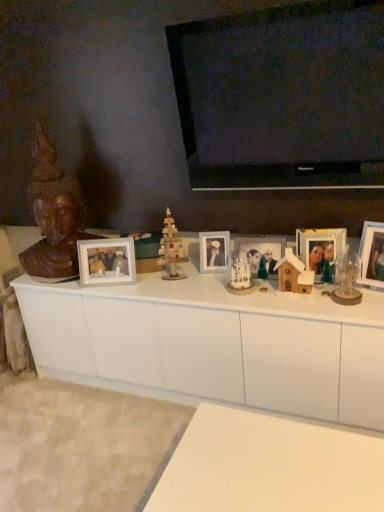
I want to click on free space in front of white ceramic snowman at center, the 2th toy from the right, so click(x=250, y=301).